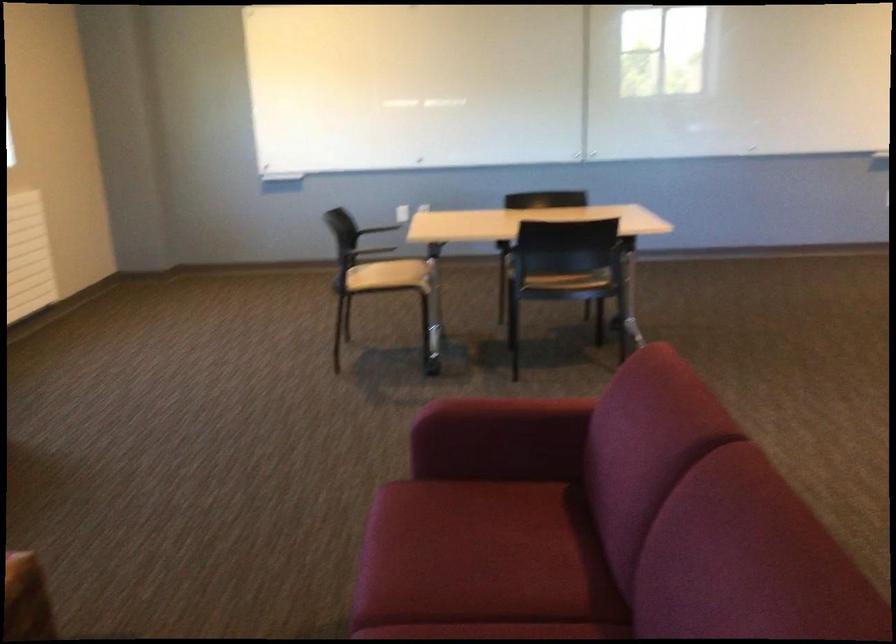
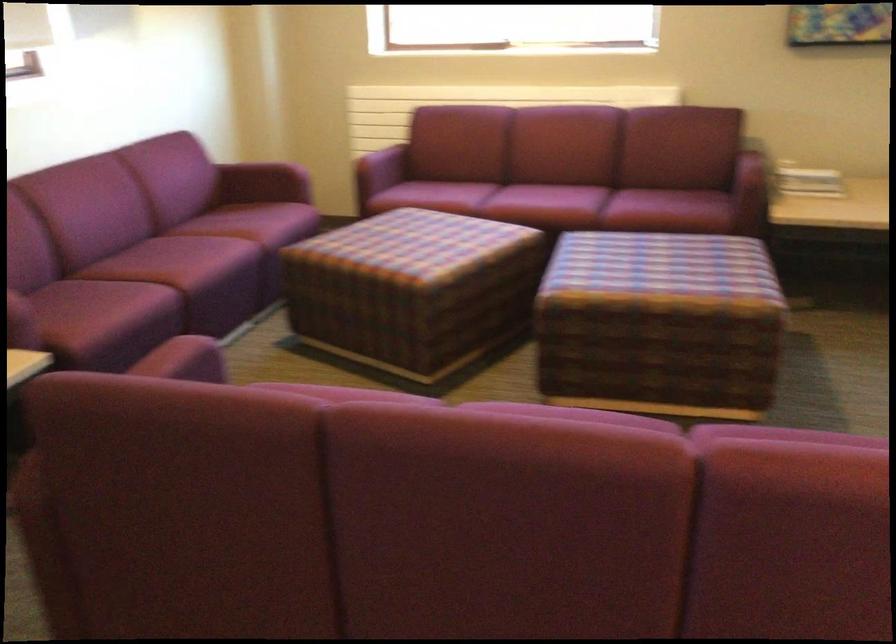
Question: I am providing you with two images of the same scene from different viewpoints. Please identify which objects are invisible in image2.

Choices:
 (A) stack of papers
 (B) square light switch
 (C) purple sofa sitting surface
 (D) red sofa sitting surface

Answer: (D)